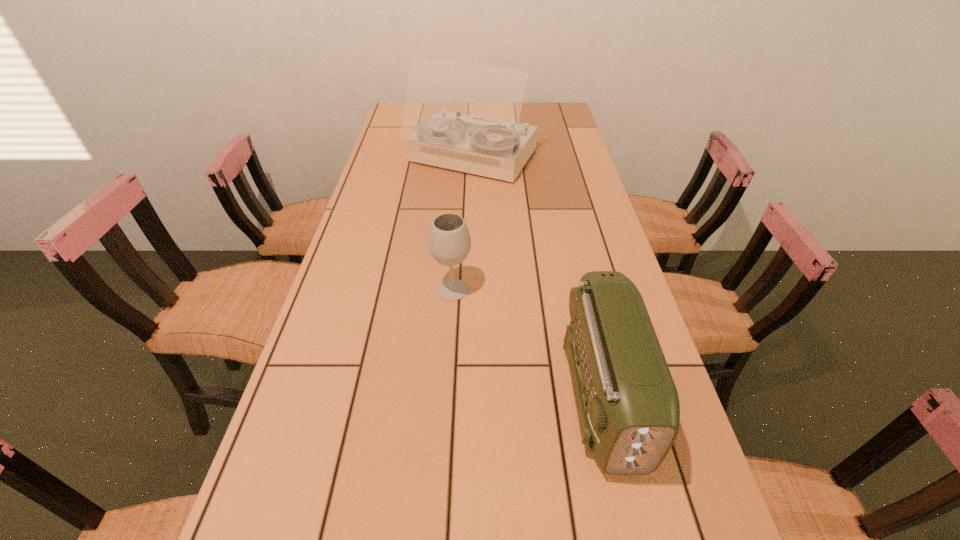
Where is `record player`? The image size is (960, 540). record player is located at coordinates (459, 115).

At what (x,y) coordinates should I click in order to perform the action: click on the tallest object. Please return your answer as a coordinate pair (x, y). This screenshot has height=540, width=960. Looking at the image, I should click on (459, 115).

Identify the location of the second nearest object. The height and width of the screenshot is (540, 960). (449, 243).

Where is `radio_receiver`? The image size is (960, 540). radio_receiver is located at coordinates (628, 408).

Where is `vacant space located on the back of the farthest object`? This screenshot has height=540, width=960. vacant space located on the back of the farthest object is located at coordinates (473, 106).

At what (x,y) coordinates should I click in order to perform the action: click on vacant space located on the front of the wineglass. Please return your answer as a coordinate pair (x, y). The width and height of the screenshot is (960, 540). Looking at the image, I should click on (447, 371).

At what (x,y) coordinates should I click in order to perform the action: click on blank space located 0.080m on the front-facing side of the nearest object. Please return your answer as a coordinate pair (x, y). The width and height of the screenshot is (960, 540). Looking at the image, I should click on (635, 534).

Find the location of a particular element. This screenshot has height=540, width=960. object that is at the left edge is located at coordinates (459, 115).

Locate an element on the screen. object that is at the right edge is located at coordinates (628, 408).

Locate an element on the screen. vacant area at the left edge of the desktop is located at coordinates (315, 338).